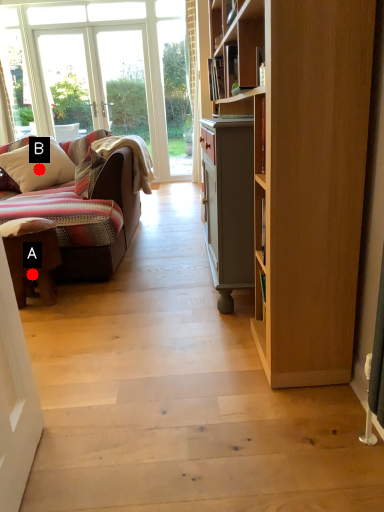
Question: Two points are circled on the image, labeled by A and B beside each circle. Which point is closer to the camera taking this photo?

Choices:
 (A) A is closer
 (B) B is closer

Answer: (A)